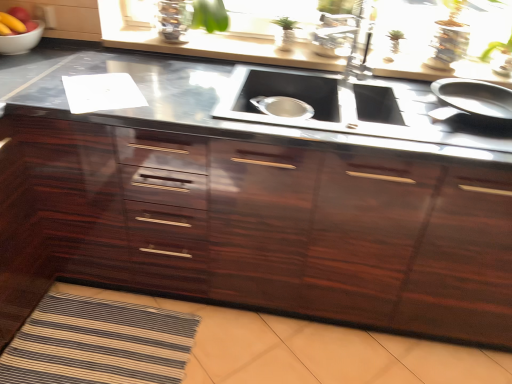
Question: Is smooth red apple at upper left in front of or behind glossy wood cabinetry at center in the image?

Choices:
 (A) front
 (B) behind

Answer: (B)

Question: Is point (10, 14) positioned closer to the camera than point (382, 160)?

Choices:
 (A) closer
 (B) farther

Answer: (B)

Question: Which is nearer to the glossy wood cabinetry at center?

Choices:
 (A) white glossy bowl at upper left
 (B) smooth red apple at upper left
 (C) black stainless steel sink at center

Answer: (C)

Question: Estimate the real-world distances between objects in this image. Which object is farther from the white glossy bowl at upper left?

Choices:
 (A) smooth red apple at upper left
 (B) glossy wood cabinetry at center
 (C) black stainless steel sink at center

Answer: (C)